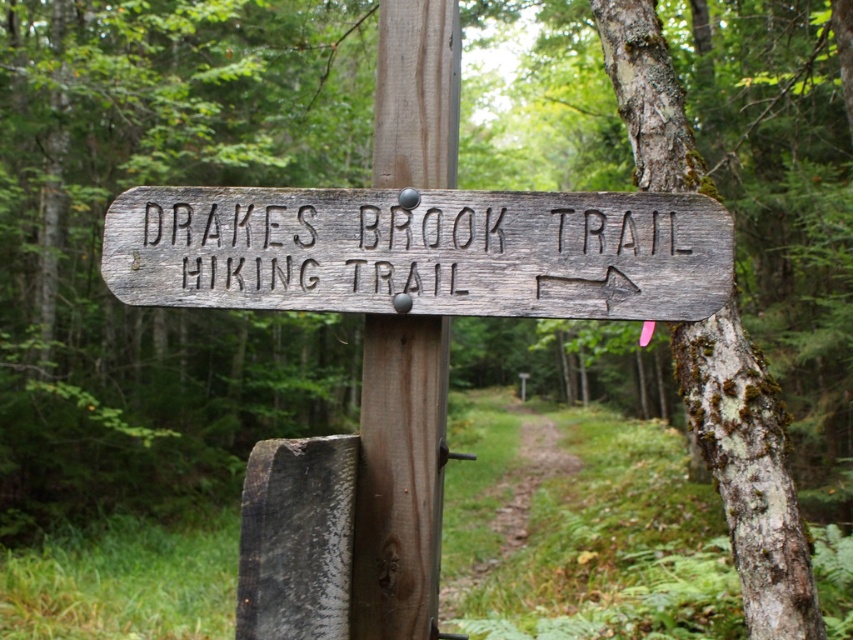
You are standing at the base of the brown wood pole at center and want to walk towards the dirt path at center. Can you step forward directly in front of you without obstacles?

The brown wood pole at center is closer to the viewer than dirt path at center, so stepping forward directly in front of you would lead you towards the dirt path at center without any obstacles between them.

You are a hiker trying to locate the Drakes Brook Trail. According to the image, where exactly is the weathered wood sign at center positioned relative to your current location?

The weathered wood sign at center is positioned at point (421, 252), which means it is slightly to the right and just below the center of your view. Follow the arrow pointing to the right on the sign to find the trail direction.

You are a hiker standing at the base of the wooden signpost in the forest. You notice two points marked on the signpost. Which point is closer to you, point (482, 305) or point (540, 472)?

Point (482, 305) is closer to you than point (540, 472).